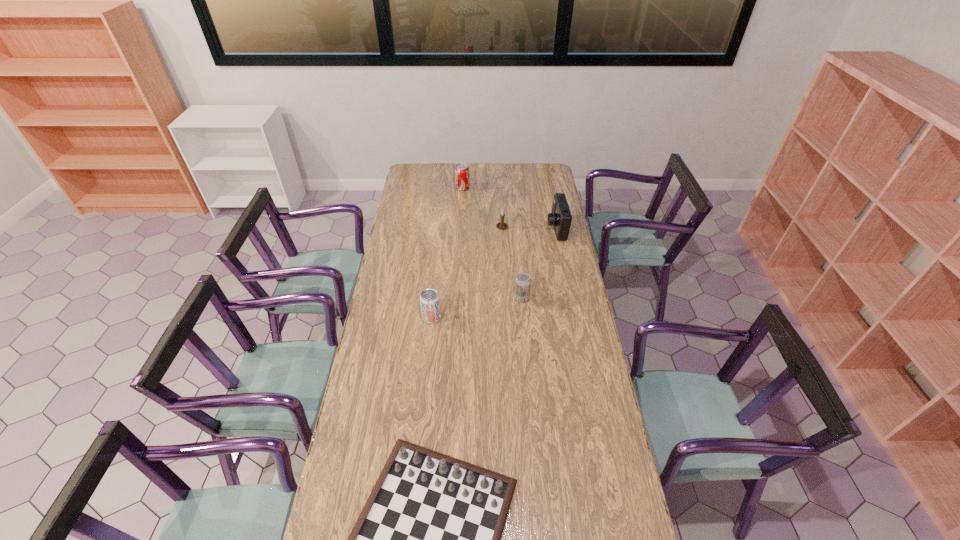
Where is `the rightmost object`? Image resolution: width=960 pixels, height=540 pixels. the rightmost object is located at coordinates (560, 217).

I want to click on the farthest soda can, so click(x=462, y=176).

At what (x,y) coordinates should I click in order to perform the action: click on the second soda can from left to right. Please return your answer as a coordinate pair (x, y). The height and width of the screenshot is (540, 960). Looking at the image, I should click on (462, 176).

The height and width of the screenshot is (540, 960). Identify the location of the nearest soda can. (429, 299).

The image size is (960, 540). Identify the location of the leftmost soda can. (429, 299).

You are a GUI agent. You are given a task and a screenshot of the screen. Output one action in this format:
    pyautogui.click(x=<x>, y=<y>)
    Task: Click on the fourth farthest object
    This screenshot has width=960, height=540.
    Given the screenshot: What is the action you would take?
    pyautogui.click(x=523, y=281)

At what (x,y) coordinates should I click in order to perform the action: click on the rightmost soda can. Please return your answer as a coordinate pair (x, y). The height and width of the screenshot is (540, 960). Looking at the image, I should click on (523, 281).

I want to click on candle holder, so click(501, 225).

Identify the location of free space located on the front-facing side of the rightmost object. Image resolution: width=960 pixels, height=540 pixels. (471, 228).

You are a GUI agent. You are given a task and a screenshot of the screen. Output one action in this format:
    pyautogui.click(x=<x>, y=<y>)
    Task: Click on the free space located 0.400m on the front-facing side of the rightmost object
    The height and width of the screenshot is (540, 960).
    Given the screenshot: What is the action you would take?
    coord(471,228)